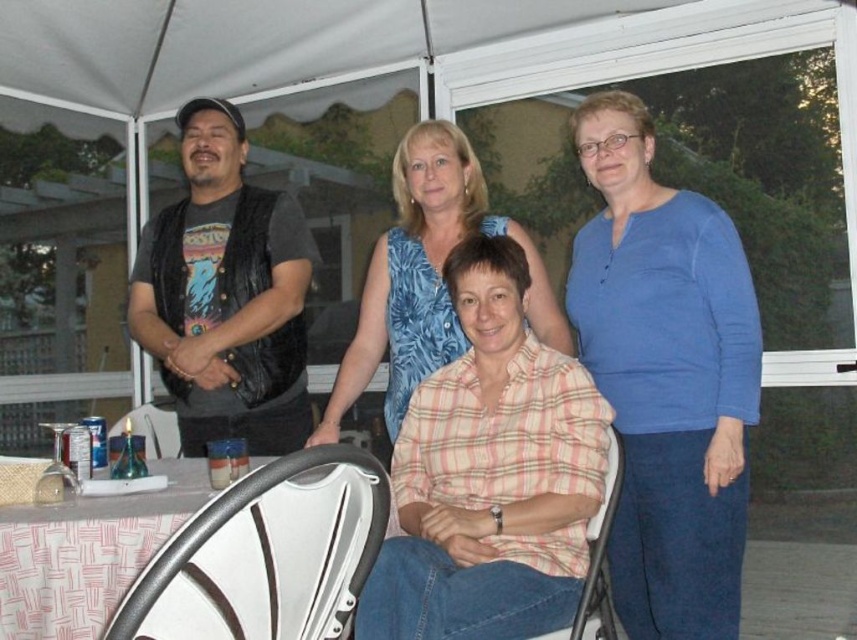
Question: Which point appears farthest from the camera in this image?

Choices:
 (A) (634, 499)
 (B) (177, 531)
 (C) (190, 468)
 (D) (148, 433)

Answer: (D)

Question: Where is pink plaid shirt at center located in relation to white plastic chair at lower center in the image?

Choices:
 (A) left
 (B) right

Answer: (A)

Question: Among these points, which one is nearest to the camera?

Choices:
 (A) (414, 364)
 (B) (691, 566)

Answer: (B)

Question: Can you confirm if pink plaid shirt at center is wider than white fabric table at lower left?

Choices:
 (A) yes
 (B) no

Answer: (A)

Question: Which object appears farthest from the camera in this image?

Choices:
 (A) blue floral dress at center
 (B) white leather chair at lower left

Answer: (A)

Question: Is white fabric table at lower left above white plastic chair at lower left?

Choices:
 (A) no
 (B) yes

Answer: (A)